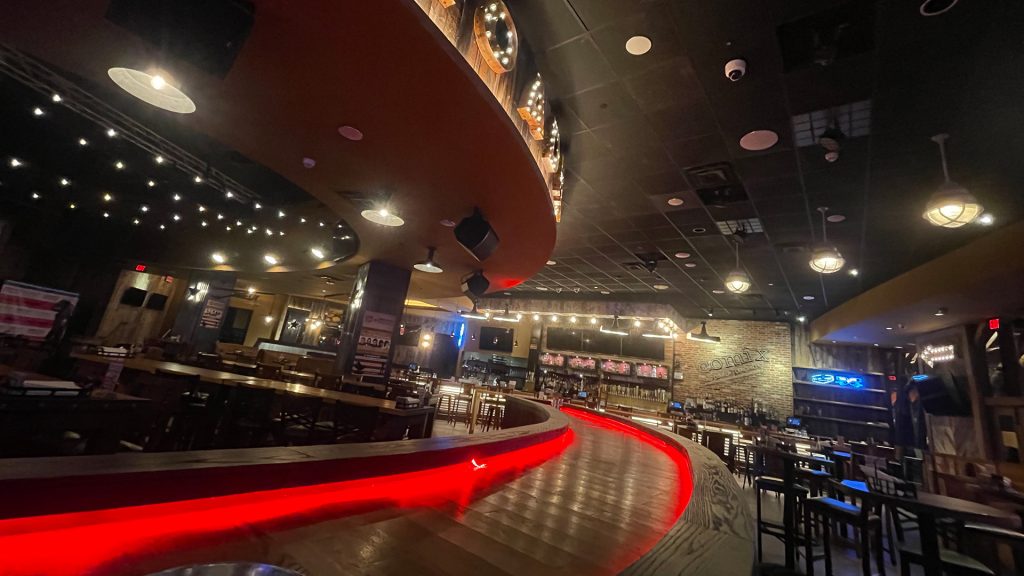
What are the coordinates of `light` in the screenshot? It's located at (384, 213).